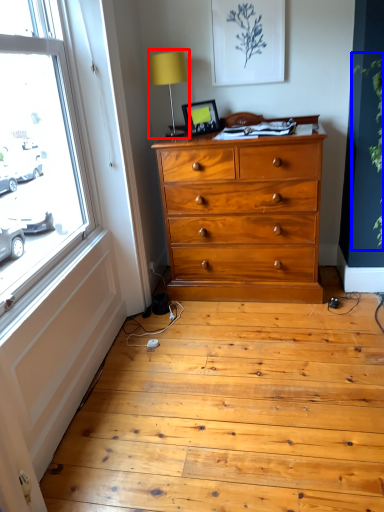
Question: Which object appears closest to the camera in this image, table lamp (highlighted by a red box) or plant (highlighted by a blue box)?

Choices:
 (A) table lamp
 (B) plant

Answer: (B)